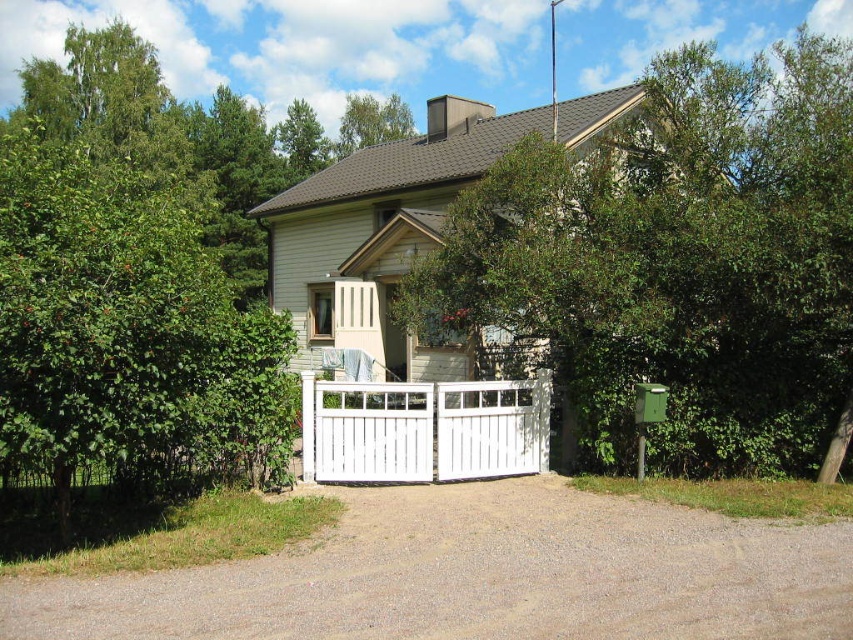
Question: Considering the relative positions of brown gravel driveway at center and white wooden gate at center in the image provided, where is brown gravel driveway at center located with respect to white wooden gate at center?

Choices:
 (A) left
 (B) right

Answer: (A)

Question: Which point is farther to the camera?

Choices:
 (A) (430, 266)
 (B) (799, 532)

Answer: (A)

Question: Is brown gravel driveway at center bigger than white wooden gate at center?

Choices:
 (A) yes
 (B) no

Answer: (B)

Question: Where is green leafy tree at upper center located in relation to white wooden gate at center in the image?

Choices:
 (A) right
 (B) left

Answer: (A)

Question: Which point is closer to the camera?

Choices:
 (A) (669, 419)
 (B) (56, 586)
 (C) (378, 397)

Answer: (B)

Question: Considering the real-world distances, which object is closest to the brown gravel driveway at center?

Choices:
 (A) green leafy tree at upper center
 (B) white wooden gate at center

Answer: (B)